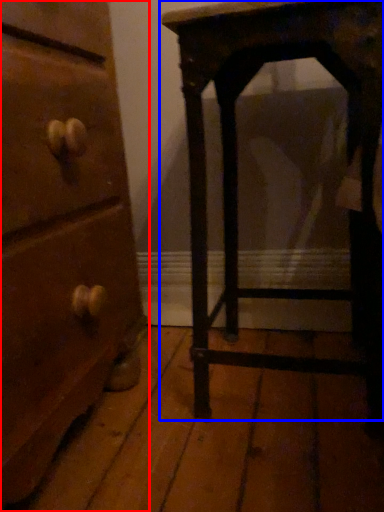
Question: Among these objects, which one is nearest to the camera, chest of drawers (highlighted by a red box) or furniture (highlighted by a blue box)?

Choices:
 (A) chest of drawers
 (B) furniture

Answer: (A)